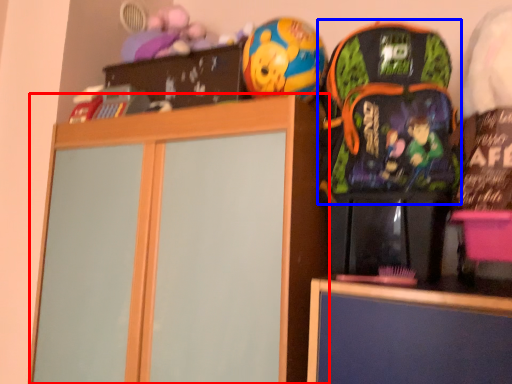
Question: Which point is further to the camera, cabinetry (highlighted by a red box) or backpack (highlighted by a blue box)?

Choices:
 (A) cabinetry
 (B) backpack

Answer: (A)